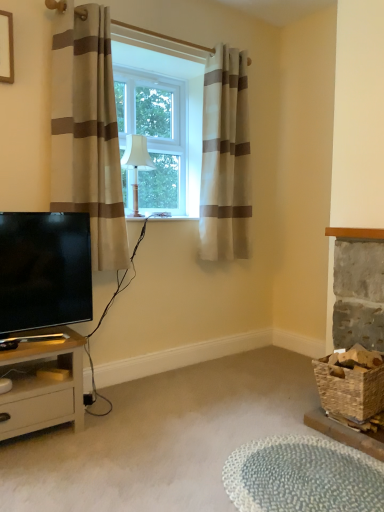
The height and width of the screenshot is (512, 384). Find the location of `empty space that is ontop of matte black tv at lower left`. empty space that is ontop of matte black tv at lower left is located at coordinates (43, 215).